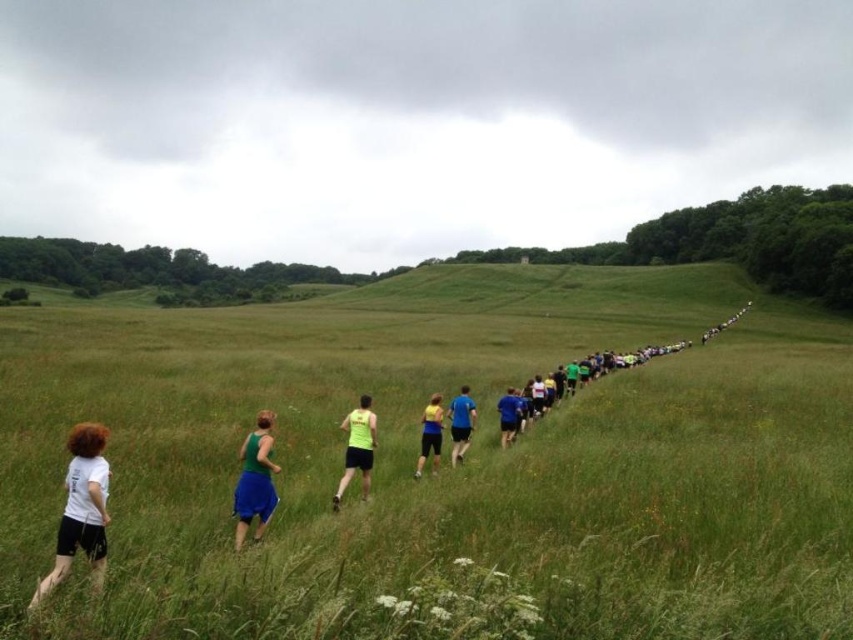
Can you confirm if green grassy field at center is positioned to the left of blue fabric shirt at center?

Indeed, green grassy field at center is positioned on the left side of blue fabric shirt at center.

Does green grassy field at center have a smaller size compared to blue fabric shirt at center?

Actually, green grassy field at center might be larger than blue fabric shirt at center.

Find the location of `green grassy field at center`. green grassy field at center is located at coordinates (447, 456).

Can you confirm if white matte t-shirt at lower left is shorter than green fabric skirt at lower left?

Yes, white matte t-shirt at lower left is shorter than green fabric skirt at lower left.

Does white matte t-shirt at lower left have a smaller size compared to green fabric skirt at lower left?

Incorrect, white matte t-shirt at lower left is not smaller in size than green fabric skirt at lower left.

Is point (50, 573) closer to camera compared to point (254, 532)?

Yes, it is.

Identify the location of white matte t-shirt at lower left. (80, 508).

You are a GUI agent. You are given a task and a screenshot of the screen. Output one action in this format:
    pyautogui.click(x=<x>, y=<y>)
    Task: Click on the green grassy field at center
    The image size is (853, 640).
    Given the screenshot: What is the action you would take?
    pyautogui.click(x=447, y=456)